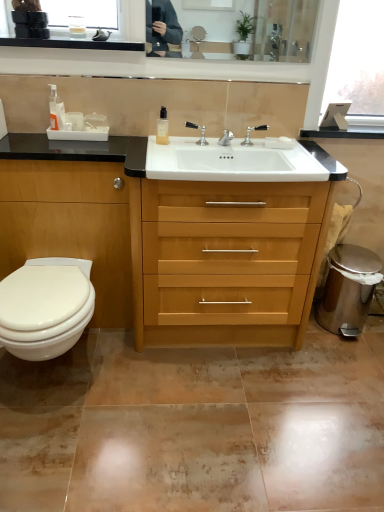
Find the location of a particular element. This screenshot has height=512, width=384. free spot to the right of white glossy toilet at lower left is located at coordinates (143, 392).